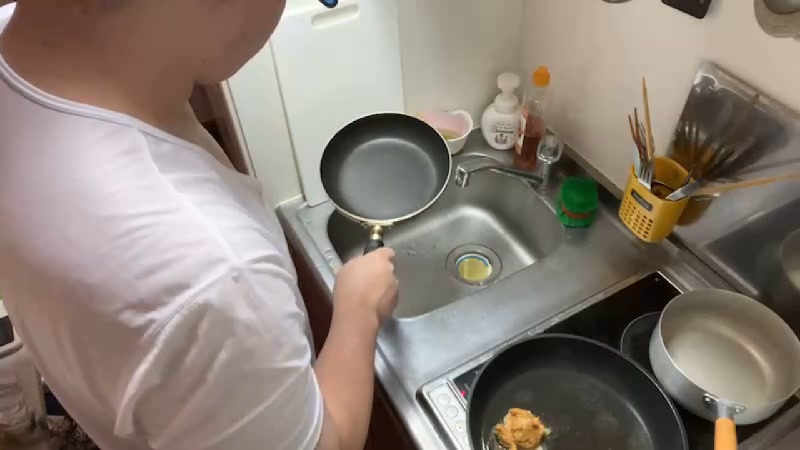
This screenshot has height=450, width=800. I want to click on scrubber, so click(558, 211).